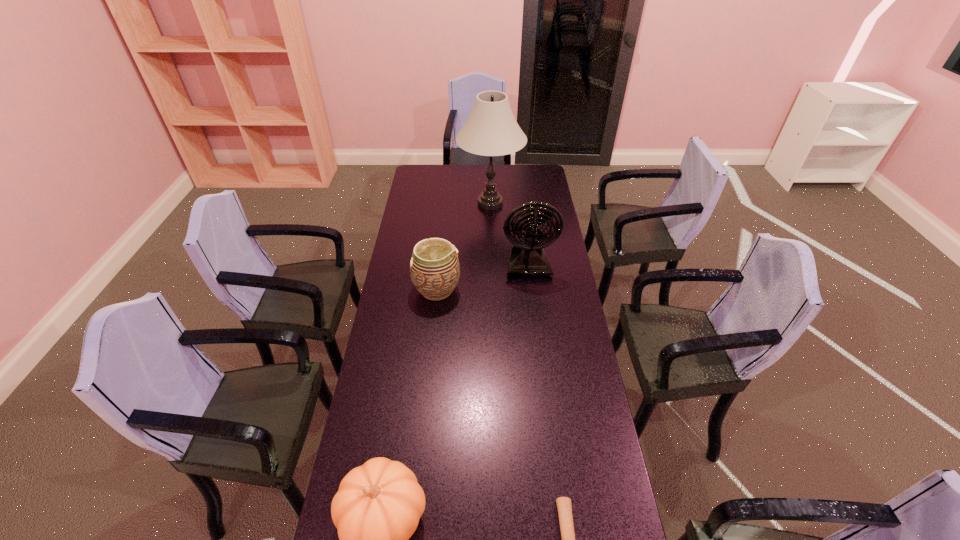
Identify the location of free region at the far edge. The width and height of the screenshot is (960, 540). (472, 181).

Locate an element on the screen. This screenshot has height=540, width=960. vacant region at the right edge of the desktop is located at coordinates (538, 194).

Image resolution: width=960 pixels, height=540 pixels. In the image, there is a desktop. In order to click on vacant space at the far left corner in this screenshot , I will do `click(428, 177)`.

Where is `vacant space that's between the pottery and the fan`? vacant space that's between the pottery and the fan is located at coordinates (482, 276).

This screenshot has width=960, height=540. Find the location of `empty location between the pottery and the lamp`. empty location between the pottery and the lamp is located at coordinates (464, 246).

I want to click on object that can be found as the fourth closest to the hammer, so click(x=491, y=130).

Where is `object that is the second closest to the fan`? Image resolution: width=960 pixels, height=540 pixels. object that is the second closest to the fan is located at coordinates (491, 130).